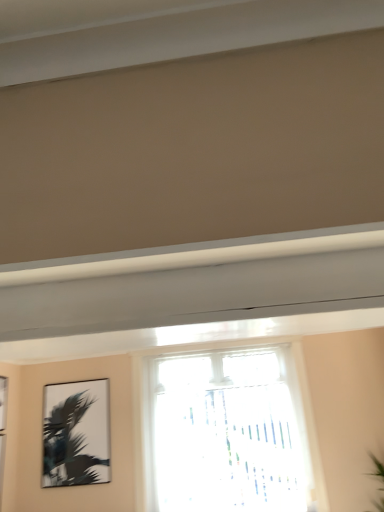
Question: From a real-world perspective, is silvery metallic palm tree at upper left above or below transparent glass window at center?

Choices:
 (A) above
 (B) below

Answer: (A)

Question: Is silvery metallic palm tree at upper left to the left or to the right of transparent glass window at center in the image?

Choices:
 (A) right
 (B) left

Answer: (B)

Question: Is silvery metallic palm tree at upper left inside or outside of transparent glass window at center?

Choices:
 (A) outside
 (B) inside

Answer: (A)

Question: Is transparent glass window at center to the left or to the right of silvery metallic palm tree at upper left in the image?

Choices:
 (A) right
 (B) left

Answer: (A)

Question: Is transparent glass window at center in front of or behind silvery metallic palm tree at upper left in the image?

Choices:
 (A) front
 (B) behind

Answer: (A)

Question: From the image's perspective, is transparent glass window at center positioned above or below silvery metallic palm tree at upper left?

Choices:
 (A) above
 (B) below

Answer: (A)

Question: Looking at the image, does transparent glass window at center seem bigger or smaller compared to silvery metallic palm tree at upper left?

Choices:
 (A) small
 (B) big

Answer: (B)